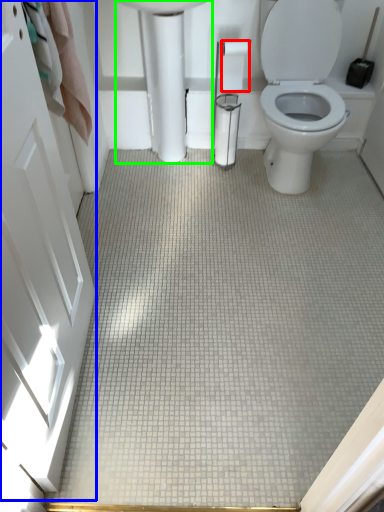
Question: Estimate the real-world distances between objects in this image. Which object is farther from toilet paper (highlighted by a red box), screen door (highlighted by a blue box) or porcelain (highlighted by a green box)?

Choices:
 (A) screen door
 (B) porcelain

Answer: (A)